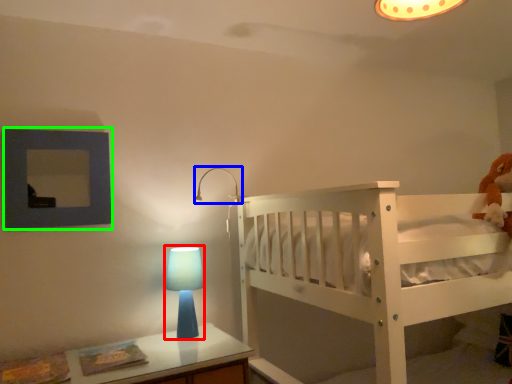
Question: Which is nearer to the table lamp (highlighted by a red box)? lamp (highlighted by a blue box) or picture frame (highlighted by a green box).

Choices:
 (A) lamp
 (B) picture frame

Answer: (A)